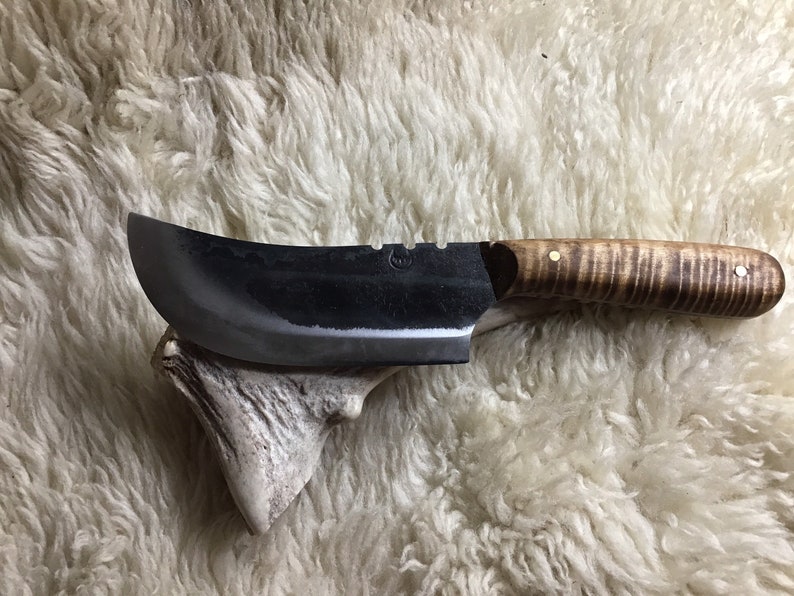
Image resolution: width=794 pixels, height=596 pixels. What are the coordinates of `white fur` in the screenshot? It's located at (326, 179).